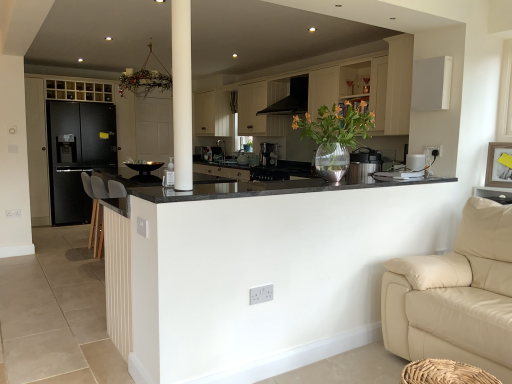
Question: Does satin black coffee machine at center have a lesser width compared to white plastic toaster at upper right, placed as the fourth appliance when sorted from left to right?

Choices:
 (A) yes
 (B) no

Answer: (B)

Question: Is satin black coffee machine at center aimed at white plastic toaster at upper right, which is counted as the first appliance, starting from the front?

Choices:
 (A) yes
 (B) no

Answer: (B)

Question: Considering the relative sizes of satin black coffee machine at center and white plastic toaster at upper right, which is counted as the first appliance, starting from the front, in the image provided, is satin black coffee machine at center bigger than white plastic toaster at upper right, which is counted as the first appliance, starting from the front,?

Choices:
 (A) no
 (B) yes

Answer: (B)

Question: Can you confirm if satin black coffee machine at center is positioned to the right of white plastic toaster at upper right, acting as the 4th appliance starting from the back?

Choices:
 (A) yes
 (B) no

Answer: (B)

Question: Considering the relative sizes of satin black coffee machine at center and white plastic toaster at upper right, placed as the fourth appliance when sorted from left to right, in the image provided, is satin black coffee machine at center smaller than white plastic toaster at upper right, placed as the fourth appliance when sorted from left to right,?

Choices:
 (A) no
 (B) yes

Answer: (A)

Question: Would you say satin black coffee maker at center, which is counted as the second appliance, starting from the left, is inside or outside white matte cabinet at upper center, positioned as the 2th cabinetry in left-to-right order?

Choices:
 (A) outside
 (B) inside

Answer: (A)

Question: From a real-world perspective, is satin black coffee maker at center, arranged as the third appliance when viewed from the right, physically located above or below white matte cabinet at upper center, positioned as the 2th cabinetry in left-to-right order?

Choices:
 (A) below
 (B) above

Answer: (A)

Question: In the image, is satin black coffee maker at center, the first appliance viewed from the back, positioned in front of or behind white matte cabinet at upper center, positioned as the 2th cabinetry in left-to-right order?

Choices:
 (A) front
 (B) behind

Answer: (B)

Question: In terms of size, does satin black coffee maker at center, which is counted as the second appliance, starting from the left, appear bigger or smaller than white matte cabinet at upper center, which is the first cabinetry from right to left?

Choices:
 (A) small
 (B) big

Answer: (A)

Question: From a real-world perspective, is black matte refrigerator at left, which ranks as the first cabinetry in left-to-right order, above or below black plastic thermos at center, the third appliance viewed from the left?

Choices:
 (A) above
 (B) below

Answer: (B)

Question: In the image, is black matte refrigerator at left, which ranks as the first cabinetry in left-to-right order, positioned in front of or behind black plastic thermos at center, which ranks as the second appliance in front-to-back order?

Choices:
 (A) front
 (B) behind

Answer: (B)

Question: Considering the positions of black matte refrigerator at left, which is counted as the 2th cabinetry, starting from the right, and black plastic thermos at center, which ranks as the second appliance in right-to-left order, in the image, is black matte refrigerator at left, which is counted as the 2th cabinetry, starting from the right, taller or shorter than black plastic thermos at center, which ranks as the second appliance in right-to-left order,?

Choices:
 (A) short
 (B) tall

Answer: (B)

Question: Looking at their shapes, would you say black matte refrigerator at left, which is counted as the 2th cabinetry, starting from the right, is wider or thinner than black plastic thermos at center, which is the 3th appliance from back to front?

Choices:
 (A) wide
 (B) thin

Answer: (A)

Question: Looking at the image, does satin silver toaster at center, the 4th appliance in the right-to-left sequence, seem bigger or smaller compared to clear glass vase at center?

Choices:
 (A) big
 (B) small

Answer: (B)

Question: Is point (239, 160) closer or farther from the camera than point (354, 122)?

Choices:
 (A) closer
 (B) farther

Answer: (B)